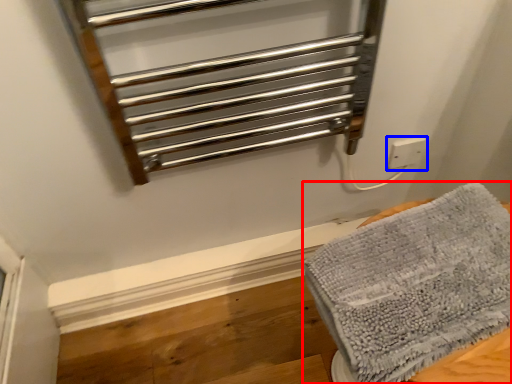
Question: Which object is further to the camera taking this photo, towel (highlighted by a red box) or electric outlet (highlighted by a blue box)?

Choices:
 (A) towel
 (B) electric outlet

Answer: (B)